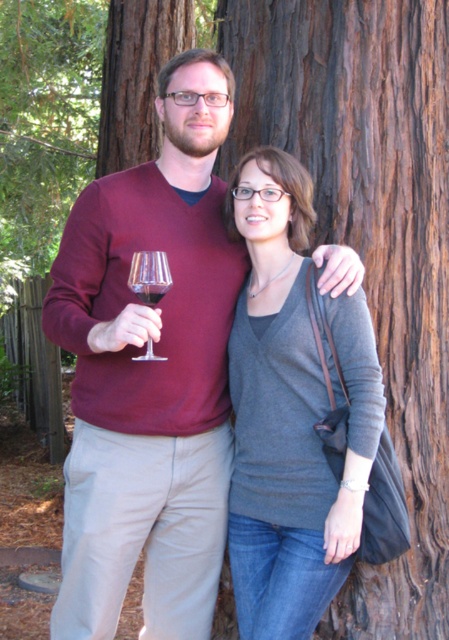
You are a photographer setting up a shot of two people wearing the maroon sweater at center and the matte gray sweater at center. Which sweater might appear larger in the photo?

The maroon sweater at center might appear larger in the photo since it might be wider than the matte gray sweater at center.

You are a fashion designer observing two sweaters in a photo. You see a maroon sweater at center and a matte gray sweater at center. Which one has a larger size?

The maroon sweater at center is bigger than the matte gray sweater at center, so the maroon sweater at center has a larger size.

You are standing in front of the large tree trunk and want to take a photo of the point at coordinates point (137, 278). If your camera has a maximum focus range of 8 feet, will it be able to focus on that point?

The point (137, 278) is 7.82 feet away from the camera, which is within the maximum focus range of 8 feet. Therefore, the camera should be able to focus on that point.